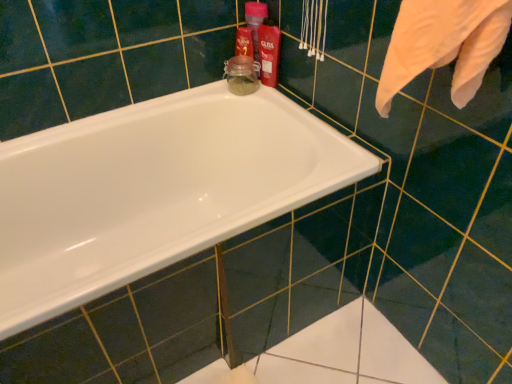
The height and width of the screenshot is (384, 512). What do you see at coordinates (154, 191) in the screenshot?
I see `white glossy bathtub at center` at bounding box center [154, 191].

Image resolution: width=512 pixels, height=384 pixels. What do you see at coordinates (269, 52) in the screenshot?
I see `shiny red plastic bottle at upper right, the second cleaning product positioned from the back` at bounding box center [269, 52].

Find the location of a particular element. The width and height of the screenshot is (512, 384). white glossy bathtub at center is located at coordinates (154, 191).

Is matte plastic bottle at upper right, the 2th cleaning product when ordered from front to back, not near white glossy bathtub at center?

That's not correct — matte plastic bottle at upper right, the 2th cleaning product when ordered from front to back, is a little close to white glossy bathtub at center.

Is matte plastic bottle at upper right, the first cleaning product in the back-to-front sequence, to the right of white glossy bathtub at center from the viewer's perspective?

Correct, you'll find matte plastic bottle at upper right, the first cleaning product in the back-to-front sequence, to the right of white glossy bathtub at center.

In the image, is matte plastic bottle at upper right, the 2th cleaning product when ordered from front to back, positioned in front of or behind white glossy bathtub at center?

In the image, matte plastic bottle at upper right, the 2th cleaning product when ordered from front to back, appears behind white glossy bathtub at center.

Based on their sizes in the image, would you say matte plastic bottle at upper right, the 2th cleaning product when ordered from front to back, is bigger or smaller than white glossy bathtub at center?

In the image, matte plastic bottle at upper right, the 2th cleaning product when ordered from front to back, appears to be smaller than white glossy bathtub at center.

Is white glossy bathtub at center not inside matte plastic bottle at upper right, the 2th cleaning product when ordered from front to back?

Indeed, white glossy bathtub at center is completely outside matte plastic bottle at upper right, the 2th cleaning product when ordered from front to back.

Could you measure the distance between white glossy bathtub at center and matte plastic bottle at upper right, the 2th cleaning product when ordered from front to back?

white glossy bathtub at center and matte plastic bottle at upper right, the 2th cleaning product when ordered from front to back, are 55.70 centimeters apart from each other.

From the image's perspective, is white glossy bathtub at center located above or below matte plastic bottle at upper right, the first cleaning product in the back-to-front sequence?

white glossy bathtub at center is below matte plastic bottle at upper right, the first cleaning product in the back-to-front sequence.

Based on the photo, is white glossy bathtub at center next to matte plastic bottle at upper right, the 2th cleaning product when ordered from front to back?

No, white glossy bathtub at center is not touching matte plastic bottle at upper right, the 2th cleaning product when ordered from front to back.

Is shiny red plastic bottle at upper right, which ranks as the first cleaning product in front-to-back order, aimed at matte plastic bottle at upper right, the first cleaning product in the back-to-front sequence?

No, shiny red plastic bottle at upper right, which ranks as the first cleaning product in front-to-back order, is not aimed at matte plastic bottle at upper right, the first cleaning product in the back-to-front sequence.

In the scene shown: From a real-world perspective, is shiny red plastic bottle at upper right, the second cleaning product positioned from the back, physically above matte plastic bottle at upper right, the first cleaning product in the back-to-front sequence?

Yes, from a real-world perspective, shiny red plastic bottle at upper right, the second cleaning product positioned from the back, is on top of matte plastic bottle at upper right, the first cleaning product in the back-to-front sequence.

Does point (270, 72) appear closer or farther from the camera than point (253, 24)?

Point (270, 72).

Considering the positions of objects shiny red plastic bottle at upper right, which ranks as the first cleaning product in front-to-back order, and matte plastic bottle at upper right, the 2th cleaning product when ordered from front to back, in the image provided, who is behind, shiny red plastic bottle at upper right, which ranks as the first cleaning product in front-to-back order, or matte plastic bottle at upper right, the 2th cleaning product when ordered from front to back,?

matte plastic bottle at upper right, the 2th cleaning product when ordered from front to back, is behind.

How different are the orientations of white glossy bathtub at center and shiny red plastic bottle at upper right, which ranks as the first cleaning product in front-to-back order, in degrees?

white glossy bathtub at center and shiny red plastic bottle at upper right, which ranks as the first cleaning product in front-to-back order, are facing 2.41 degrees away from each other.

From a real-world perspective, who is located lower, white glossy bathtub at center or shiny red plastic bottle at upper right, which ranks as the first cleaning product in front-to-back order?

white glossy bathtub at center is physically lower.

Is white glossy bathtub at center next to shiny red plastic bottle at upper right, which ranks as the first cleaning product in front-to-back order?

white glossy bathtub at center and shiny red plastic bottle at upper right, which ranks as the first cleaning product in front-to-back order, are not in contact.

Which is more to the left, white glossy bathtub at center or shiny red plastic bottle at upper right, which ranks as the first cleaning product in front-to-back order?

Positioned to the left is white glossy bathtub at center.

Is shiny red plastic bottle at upper right, the second cleaning product positioned from the back, shorter than white glossy bathtub at center?

Yes.

Starting from the white glossy bathtub at center, which cleaning product is the 1st one behind? Please provide its 2D coordinates.

[(269, 52)]

Which is behind, shiny red plastic bottle at upper right, which ranks as the first cleaning product in front-to-back order, or white glossy bathtub at center?

shiny red plastic bottle at upper right, which ranks as the first cleaning product in front-to-back order.

Is point (255, 56) positioned after point (279, 57)?

Yes.

Can you confirm if matte plastic bottle at upper right, the first cleaning product in the back-to-front sequence, is taller than shiny red plastic bottle at upper right, which ranks as the first cleaning product in front-to-back order?

Indeed, matte plastic bottle at upper right, the first cleaning product in the back-to-front sequence, has a greater height compared to shiny red plastic bottle at upper right, which ranks as the first cleaning product in front-to-back order.

Identify the location of cleaning product behind the shiny red plastic bottle at upper right, the second cleaning product positioned from the back. (255, 25).

Is matte plastic bottle at upper right, the 2th cleaning product when ordered from front to back, facing towards shiny red plastic bottle at upper right, which ranks as the first cleaning product in front-to-back order?

Yes, matte plastic bottle at upper right, the 2th cleaning product when ordered from front to back, is turned towards shiny red plastic bottle at upper right, which ranks as the first cleaning product in front-to-back order.

You are a GUI agent. You are given a task and a screenshot of the screen. Output one action in this format:
    pyautogui.click(x=<x>, y=<y>)
    Task: Click on the bathtub in front of the matte plastic bottle at upper right, the 2th cleaning product when ordered from front to back
    The height and width of the screenshot is (384, 512).
    Given the screenshot: What is the action you would take?
    pyautogui.click(x=154, y=191)

I want to click on bathtub below the matte plastic bottle at upper right, the first cleaning product in the back-to-front sequence (from the image's perspective), so (x=154, y=191).

When comparing their distances from matte plastic bottle at upper right, the 2th cleaning product when ordered from front to back, does shiny red plastic bottle at upper right, which ranks as the first cleaning product in front-to-back order, or white glossy bathtub at center seem further?

white glossy bathtub at center.

When comparing their distances from matte plastic bottle at upper right, the first cleaning product in the back-to-front sequence, does white glossy bathtub at center or shiny red plastic bottle at upper right, which ranks as the first cleaning product in front-to-back order, seem closer?

Among the two, shiny red plastic bottle at upper right, which ranks as the first cleaning product in front-to-back order, is located nearer to matte plastic bottle at upper right, the first cleaning product in the back-to-front sequence.

Estimate the real-world distances between objects in this image. Which object is closer to shiny red plastic bottle at upper right, which ranks as the first cleaning product in front-to-back order, white glossy bathtub at center or matte plastic bottle at upper right, the first cleaning product in the back-to-front sequence?

Based on the image, matte plastic bottle at upper right, the first cleaning product in the back-to-front sequence, appears to be nearer to shiny red plastic bottle at upper right, which ranks as the first cleaning product in front-to-back order.

Considering their positions, is matte plastic bottle at upper right, the first cleaning product in the back-to-front sequence, positioned further to white glossy bathtub at center than shiny red plastic bottle at upper right, which ranks as the first cleaning product in front-to-back order?

matte plastic bottle at upper right, the first cleaning product in the back-to-front sequence.

When comparing their distances from shiny red plastic bottle at upper right, which ranks as the first cleaning product in front-to-back order, does matte plastic bottle at upper right, the first cleaning product in the back-to-front sequence, or white glossy bathtub at center seem closer?

matte plastic bottle at upper right, the first cleaning product in the back-to-front sequence, is positioned closer to the anchor shiny red plastic bottle at upper right, which ranks as the first cleaning product in front-to-back order.

Based on their spatial positions, is shiny red plastic bottle at upper right, which ranks as the first cleaning product in front-to-back order, or matte plastic bottle at upper right, the first cleaning product in the back-to-front sequence, closer to white glossy bathtub at center?

shiny red plastic bottle at upper right, which ranks as the first cleaning product in front-to-back order, lies closer to white glossy bathtub at center than the other object.

The width and height of the screenshot is (512, 384). Find the location of `cleaning product between white glossy bathtub at center and matte plastic bottle at upper right, the 2th cleaning product when ordered from front to back, along the z-axis`. cleaning product between white glossy bathtub at center and matte plastic bottle at upper right, the 2th cleaning product when ordered from front to back, along the z-axis is located at coordinates (269, 52).